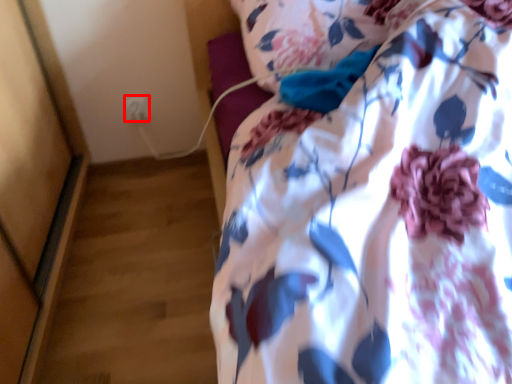
Question: Observing the image, what is the correct spatial positioning of electric outlet (annotated by the red box) in reference to pillow?

Choices:
 (A) left
 (B) right

Answer: (A)